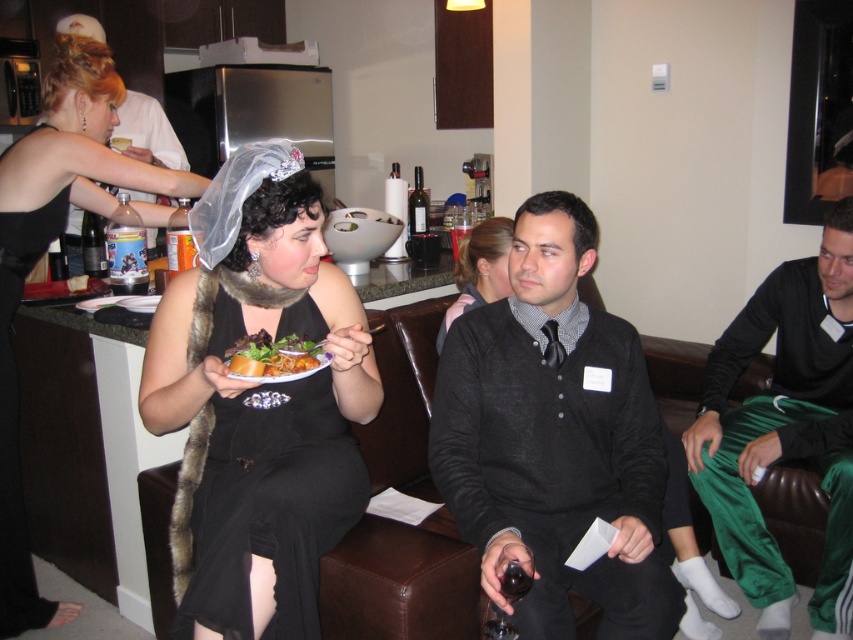
Question: Can you confirm if black fur stole at center is positioned to the right of matte black shirt at upper center?

Choices:
 (A) no
 (B) yes

Answer: (B)

Question: Based on their relative distances, which object is nearer to the shiny dark glass at lower center?

Choices:
 (A) black satin dress at left
 (B) velvet black dress at center
 (C) black fur stole at center

Answer: (C)

Question: Is black fur stole at center behind dark glass bottle at center?

Choices:
 (A) yes
 (B) no

Answer: (B)

Question: Which point is closer to the camera taking this photo?

Choices:
 (A) (3, 364)
 (B) (311, 358)

Answer: (B)

Question: Among these objects, which one is farthest from the camera?

Choices:
 (A) shiny dark glass at lower center
 (B) dark glass bottle at center
 (C) matte black plate with salad and sandwich at center

Answer: (B)

Question: From the image, what is the correct spatial relationship of dark gray sweater at center in relation to shiny dark glass at lower center?

Choices:
 (A) below
 (B) above

Answer: (B)